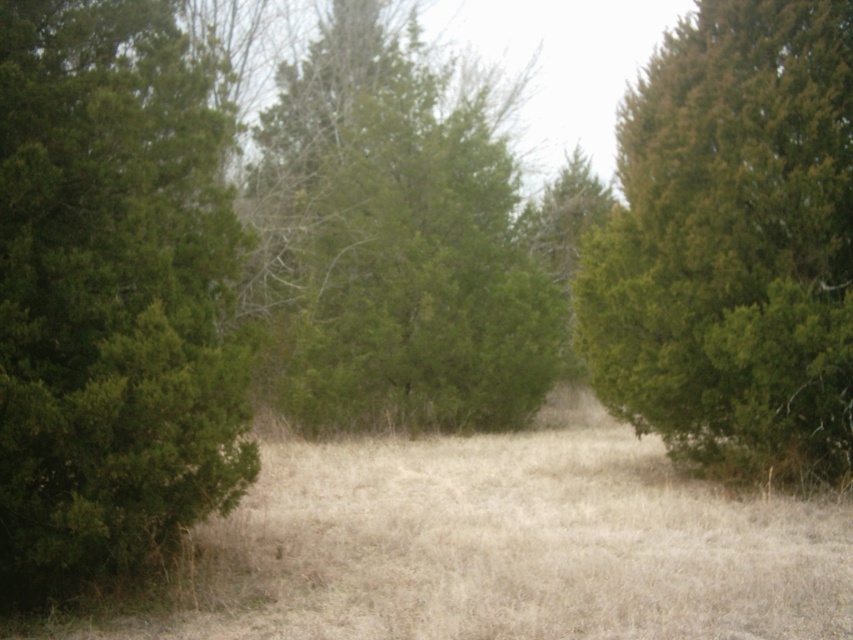
You are standing in the center of the dry grass at center and want to walk towards the green matte tree at left. Which direction should you head?

The green matte tree at left is positioned on the left side of dry grass at center, so you should head to the left to reach it.

You are standing in the field of dry grass and want to walk towards the point marked at coordinates point (641, 157) and point (445, 113). Which point will you reach first?

Point (641, 157) is in front of point (445, 113), so you will reach point (641, 157) first.

You are standing at the center of the field of dry, golden grass. Which direction should you walk to reach the green matte tree at left?

You should walk to the left to reach the green matte tree at left, which is located at point (109,296).